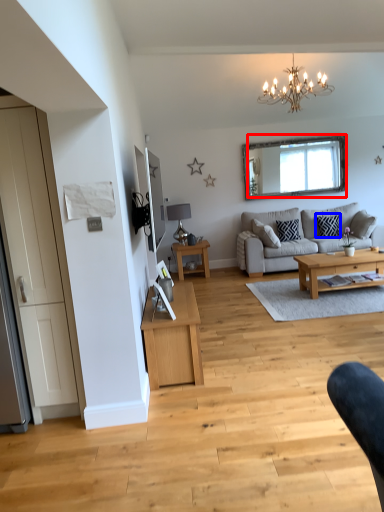
Question: Which point is closer to the camera, mirror (highlighted by a red box) or pillow (highlighted by a blue box)?

Choices:
 (A) mirror
 (B) pillow

Answer: (B)